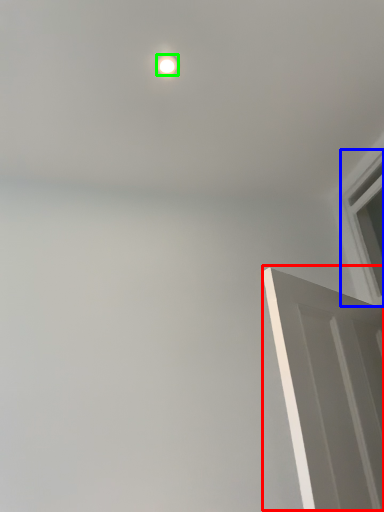
Question: Considering the real-world distances, which object is closest to door (highlighted by a red box)? window (highlighted by a blue box) or lighting (highlighted by a green box).

Choices:
 (A) window
 (B) lighting

Answer: (A)